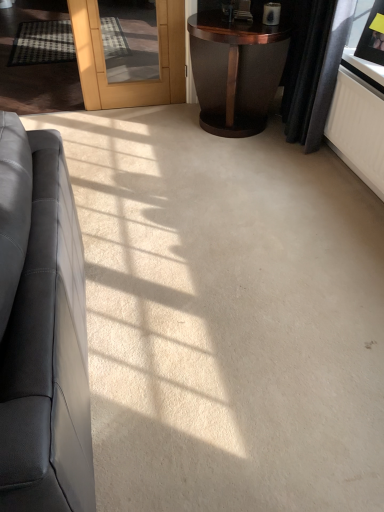
Question: Visually, is black velvet curtain at upper right positioned to the left or to the right of dark wood side table at upper right?

Choices:
 (A) left
 (B) right

Answer: (B)

Question: Considering the positions of black velvet curtain at upper right and dark wood side table at upper right in the image, is black velvet curtain at upper right bigger or smaller than dark wood side table at upper right?

Choices:
 (A) small
 (B) big

Answer: (A)

Question: Which object is the closest to the matte black picture frame at upper right?

Choices:
 (A) dark wood side table at upper right
 (B) matte black couch at left
 (C) black velvet curtain at upper right

Answer: (C)

Question: Which is farther from the dark wood side table at upper right?

Choices:
 (A) black velvet curtain at upper right
 (B) matte black couch at left
 (C) matte black picture frame at upper right

Answer: (B)